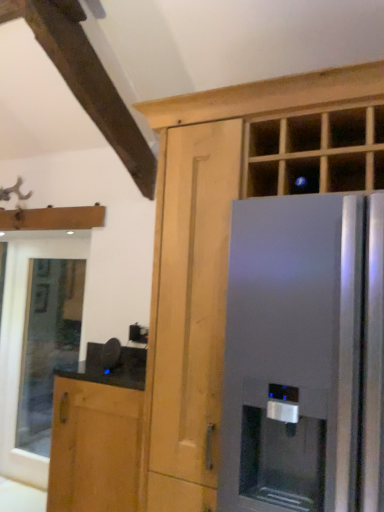
Question: From a real-world perspective, is satin silver refrigerator at right on top of brown wood cabinet at lower left, acting as the 1th cabinetry starting from the left?

Choices:
 (A) yes
 (B) no

Answer: (A)

Question: Is satin silver refrigerator at right directly adjacent to brown wood cabinet at lower left, which ranks as the 2th cabinetry in right-to-left order?

Choices:
 (A) yes
 (B) no

Answer: (B)

Question: From the image's perspective, is satin silver refrigerator at right on brown wood cabinet at lower left, which ranks as the 2th cabinetry in right-to-left order?

Choices:
 (A) yes
 (B) no

Answer: (A)

Question: Does satin silver refrigerator at right have a lesser height compared to brown wood cabinet at lower left, which ranks as the 2th cabinetry in right-to-left order?

Choices:
 (A) no
 (B) yes

Answer: (A)

Question: Can you confirm if satin silver refrigerator at right is positioned to the left of brown wood cabinet at lower left, which ranks as the 2th cabinetry in right-to-left order?

Choices:
 (A) yes
 (B) no

Answer: (B)

Question: Based on their positions, is brown wood cabinet at lower left, which ranks as the 2th cabinetry in right-to-left order, located to the left or right of satin silver refrigerator at right?

Choices:
 (A) left
 (B) right

Answer: (A)

Question: Looking at the image, does brown wood cabinet at lower left, acting as the 1th cabinetry starting from the left, seem bigger or smaller compared to satin silver refrigerator at right?

Choices:
 (A) small
 (B) big

Answer: (A)

Question: Considering the positions of brown wood cabinet at lower left, which ranks as the 2th cabinetry in right-to-left order, and satin silver refrigerator at right in the image, is brown wood cabinet at lower left, which ranks as the 2th cabinetry in right-to-left order, wider or thinner than satin silver refrigerator at right?

Choices:
 (A) wide
 (B) thin

Answer: (B)

Question: Is brown wood cabinet at lower left, acting as the 1th cabinetry starting from the left, inside or outside of satin silver refrigerator at right?

Choices:
 (A) inside
 (B) outside

Answer: (B)

Question: Is brown wood cabinet at lower left, acting as the 1th cabinetry starting from the left, wider or thinner than matte wood cabinet at center, which is the first cabinetry from right to left?

Choices:
 (A) wide
 (B) thin

Answer: (B)

Question: From a real-world perspective, is brown wood cabinet at lower left, which ranks as the 2th cabinetry in right-to-left order, physically located above or below matte wood cabinet at center, which is the first cabinetry from right to left?

Choices:
 (A) above
 (B) below

Answer: (B)

Question: In the image, is brown wood cabinet at lower left, acting as the 1th cabinetry starting from the left, on the left side or the right side of matte wood cabinet at center, marked as the 2th cabinetry in a left-to-right arrangement?

Choices:
 (A) left
 (B) right

Answer: (A)

Question: In terms of size, does brown wood cabinet at lower left, acting as the 1th cabinetry starting from the left, appear bigger or smaller than matte wood cabinet at center, marked as the 2th cabinetry in a left-to-right arrangement?

Choices:
 (A) big
 (B) small

Answer: (B)

Question: In the image, is clear glass window at lower left positioned in front of or behind matte wood cabinet at center, marked as the 2th cabinetry in a left-to-right arrangement?

Choices:
 (A) front
 (B) behind

Answer: (B)

Question: Is clear glass window at lower left wider or thinner than matte wood cabinet at center, marked as the 2th cabinetry in a left-to-right arrangement?

Choices:
 (A) thin
 (B) wide

Answer: (A)